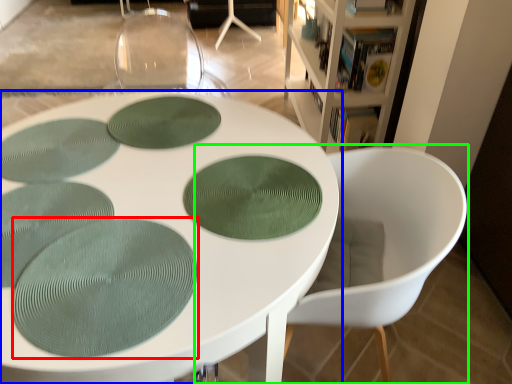
Question: Which object is the farthest from oval (highlighted by a red box)? Choose among these: table (highlighted by a blue box) or chair (highlighted by a green box).

Choices:
 (A) table
 (B) chair

Answer: (B)